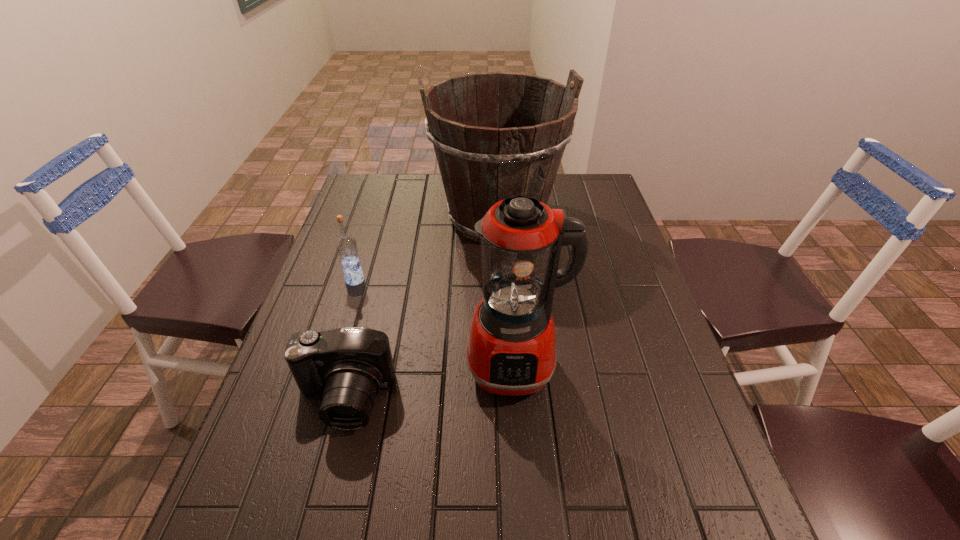
Where is `bucket`? bucket is located at coordinates (496, 135).

Find the location of a particular element. Image resolution: width=960 pixels, height=540 pixels. food processor is located at coordinates (511, 350).

Find the location of a particular element. the third nearest object is located at coordinates point(346,245).

Identify the location of the second shortest object. (346, 245).

The width and height of the screenshot is (960, 540). I want to click on camera, so click(351, 364).

Image resolution: width=960 pixels, height=540 pixels. Identify the location of vacant region located on the back of the bucket. (494, 177).

Locate an element on the screen. The height and width of the screenshot is (540, 960). vacant space located on the controls of the food processor is located at coordinates (521, 442).

Where is `vacant area situated on the front of the third nearest object`? This screenshot has height=540, width=960. vacant area situated on the front of the third nearest object is located at coordinates (332, 355).

Locate an element on the screen. The image size is (960, 540). vacant space located on the lens of the camera is located at coordinates (306, 539).

Locate an element on the screen. The image size is (960, 540). object that is positioned at the far edge is located at coordinates (496, 135).